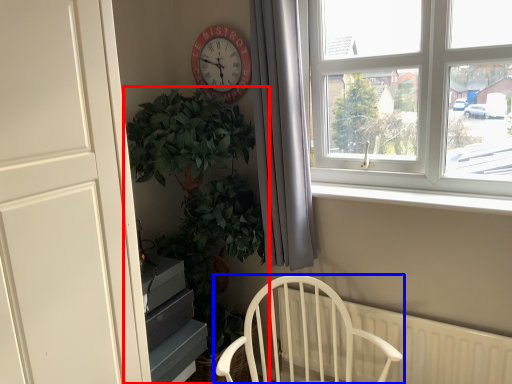
Question: Which object appears closest to the camera in this image, houseplant (highlighted by a red box) or chair (highlighted by a blue box)?

Choices:
 (A) houseplant
 (B) chair

Answer: (B)